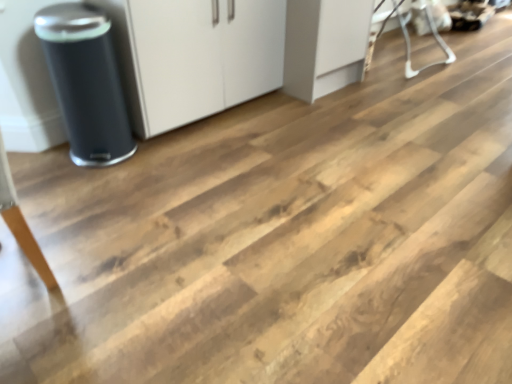
Question: Considering the relative positions of white plastic baby bouncer at upper right and matte black trash can at left in the image provided, is white plastic baby bouncer at upper right to the left or to the right of matte black trash can at left?

Choices:
 (A) left
 (B) right

Answer: (B)

Question: Looking at the image, does white plastic baby bouncer at upper right seem bigger or smaller compared to matte black trash can at left?

Choices:
 (A) small
 (B) big

Answer: (B)

Question: Estimate the real-world distances between objects in this image. Which object is farther from the matte black trash can at left?

Choices:
 (A) white matte cabinet at center
 (B) white plastic baby bouncer at upper right

Answer: (B)

Question: Which of these objects is positioned closest to the white matte cabinet at center?

Choices:
 (A) white plastic baby bouncer at upper right
 (B) matte black trash can at left

Answer: (B)